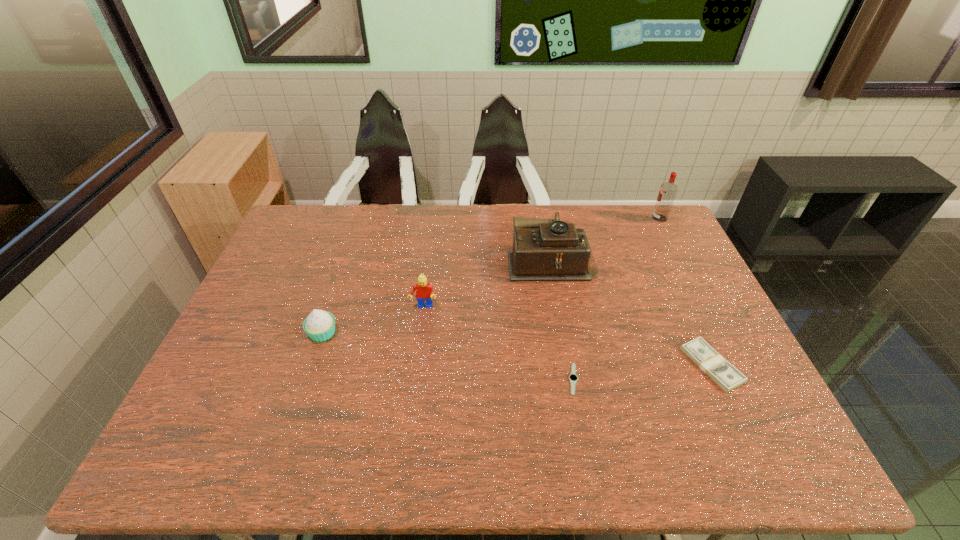
Find the location of a particular element. free space that satisfies the following two spatial constraints: 1. on the horn of the fifth nearest object; 2. on the back side of the dollar is located at coordinates (569, 365).